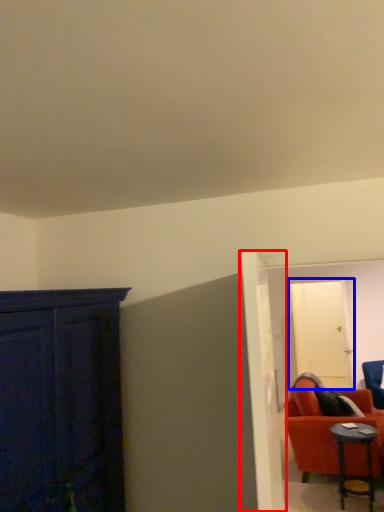
Question: Among these objects, which one is farthest to the camera, door (highlighted by a red box) or door (highlighted by a blue box)?

Choices:
 (A) door
 (B) door

Answer: (B)